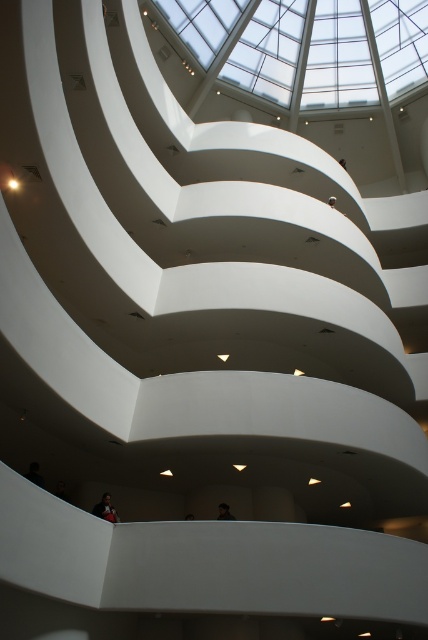
Question: Which object appears closest to the camera in this image?

Choices:
 (A) dark brown hair at upper center
 (B) dark brown leather jacket at lower center

Answer: (B)

Question: Which of the following is the closest to the observer?

Choices:
 (A) (220, 515)
 (B) (98, 502)

Answer: (B)

Question: Which point is closer to the camera?

Choices:
 (A) (112, 515)
 (B) (217, 509)

Answer: (A)

Question: Does dark brown leather jacket at lower center have a lesser width compared to dark brown hair at upper center?

Choices:
 (A) no
 (B) yes

Answer: (A)

Question: Is dark brown leather jacket at lower center thinner than dark brown hair at upper center?

Choices:
 (A) yes
 (B) no

Answer: (B)

Question: Is dark brown leather jacket at lower center to the left of dark brown hair at upper center from the viewer's perspective?

Choices:
 (A) yes
 (B) no

Answer: (A)